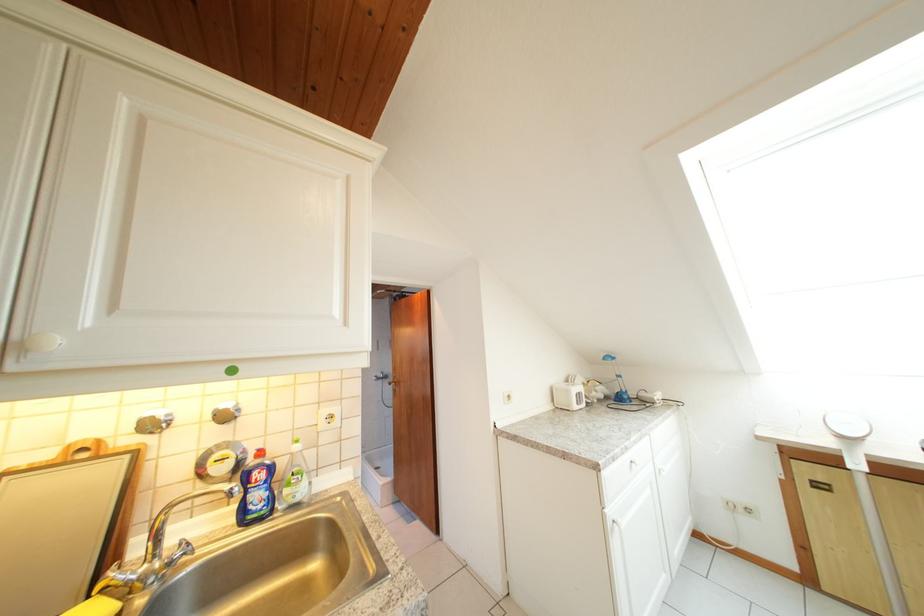
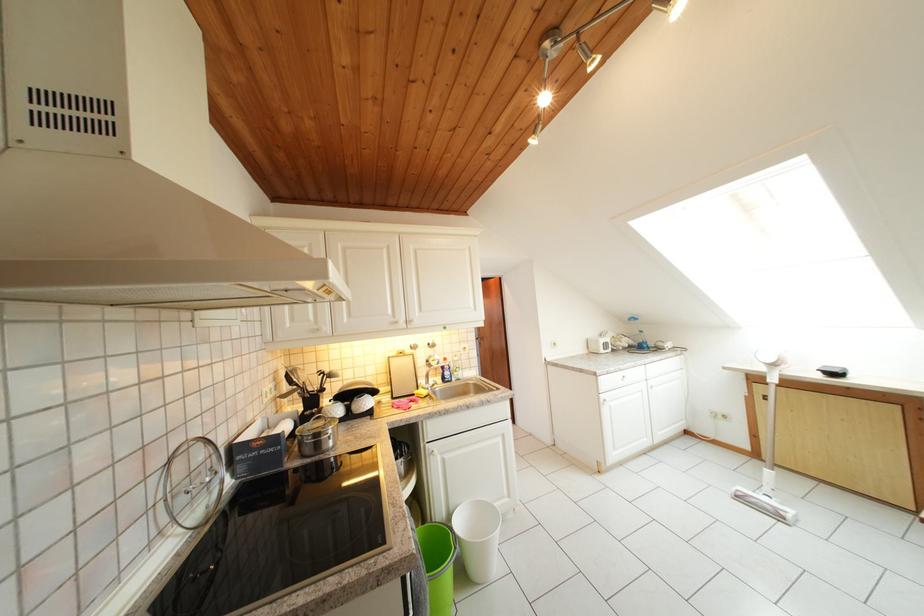
Find the pixel in the second image that matches (577,397) in the first image.

(605, 347)